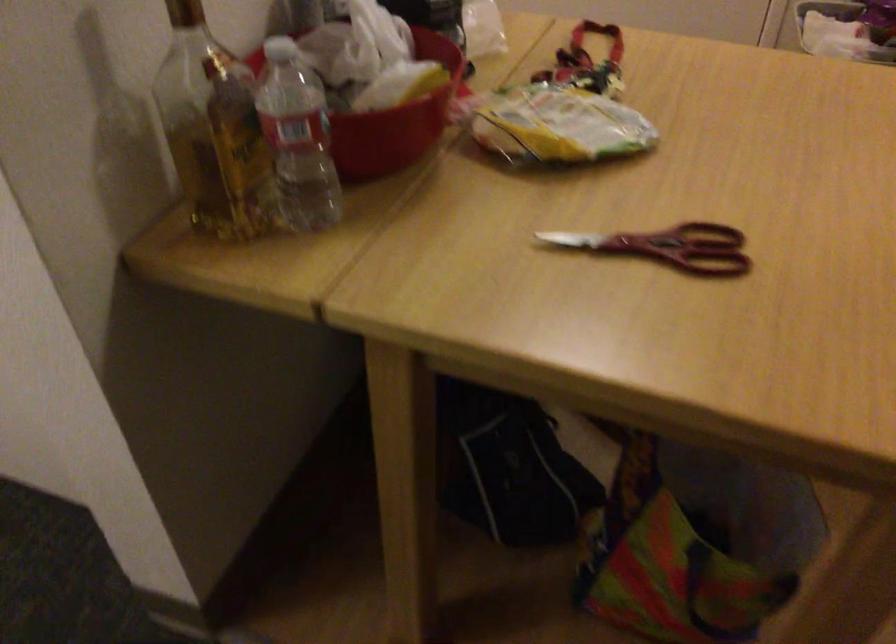
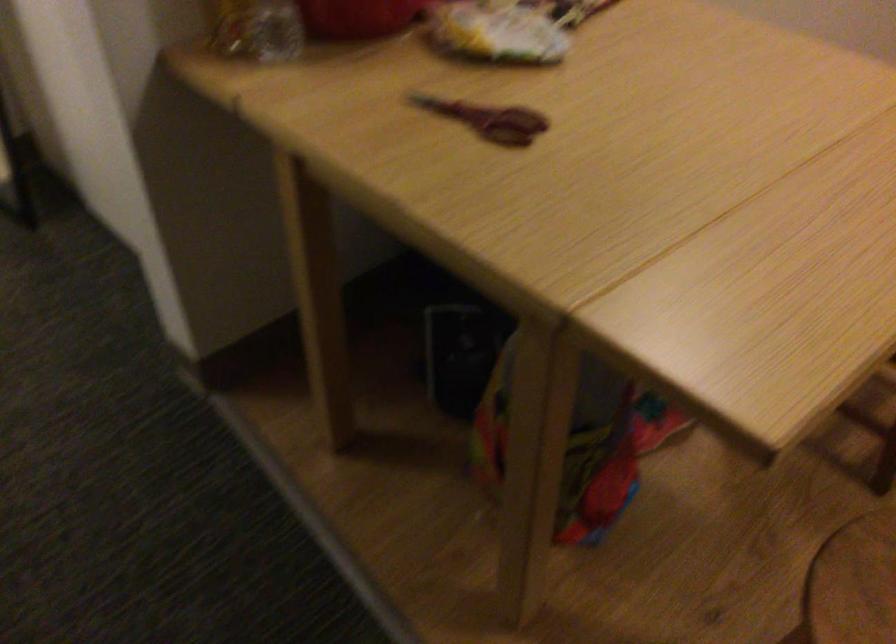
Question: Which direction would the cameraman need to move to produce the second image? Reply with the corresponding letter.

Choices:
 (A) Left
 (B) Right
 (C) Forward
 (D) Backward

Answer: (B)